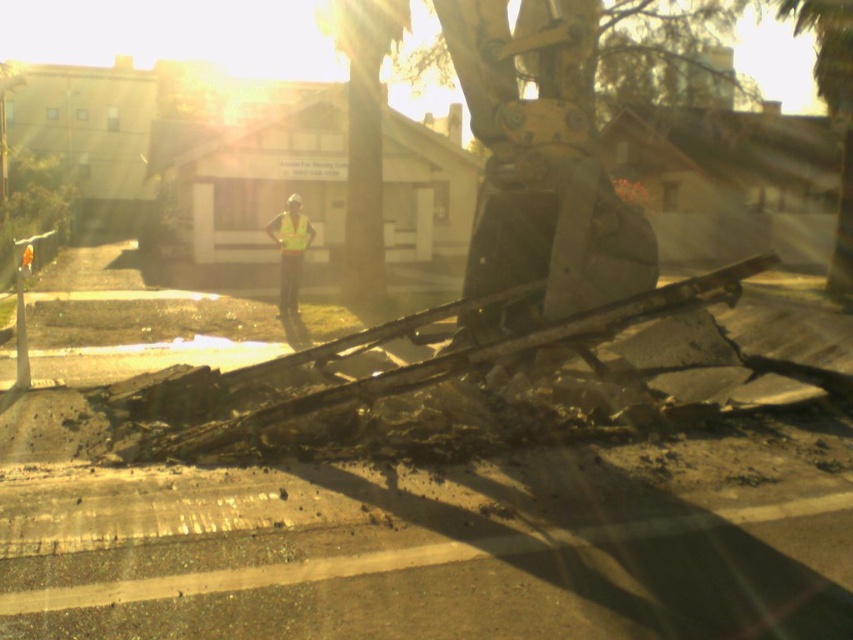
Looking at this image, does green leafy tree at center lie behind yellow reflective vest at center?

Yes, it is.

Locate an element on the screen. Image resolution: width=853 pixels, height=640 pixels. green leafy tree at center is located at coordinates (363, 138).

Consider the image. Measure the distance from green leafy tree at center to green leafy tree at upper right.

A distance of 13.90 meters exists between green leafy tree at center and green leafy tree at upper right.

Can you confirm if green leafy tree at center is smaller than green leafy tree at upper right?

A: Yes, green leafy tree at center is smaller than green leafy tree at upper right.

Which is in front, point (347, 128) or point (840, 211)?

Point (840, 211) is more forward.

Locate an element on the screen. green leafy tree at center is located at coordinates (363, 138).

The width and height of the screenshot is (853, 640). I want to click on green leafy tree at upper right, so click(833, 113).

Is green leafy tree at upper right positioned at the back of yellow reflective vest at center?

That is True.

Which is in front, point (786, 6) or point (303, 248)?

Positioned in front is point (303, 248).

Identify the location of green leafy tree at upper right. (833, 113).